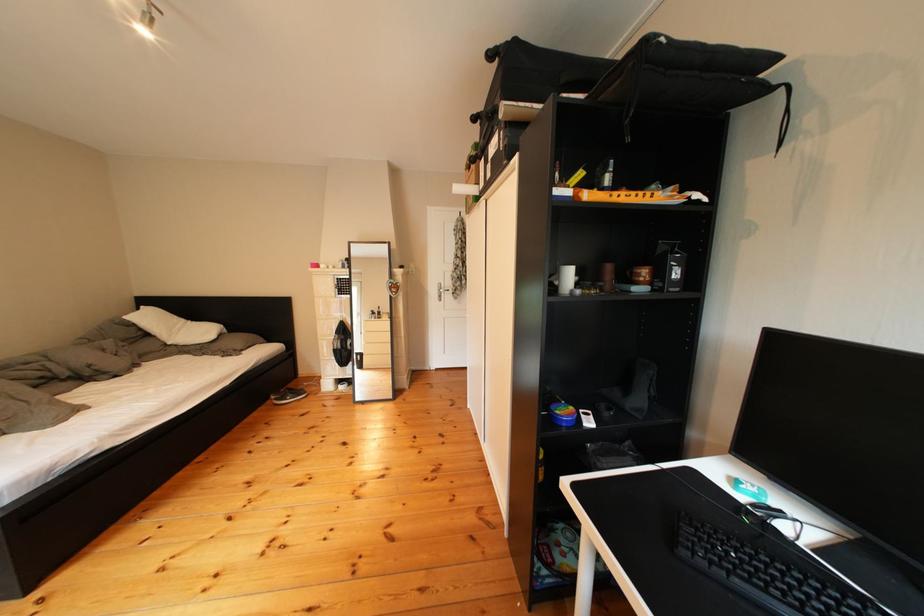
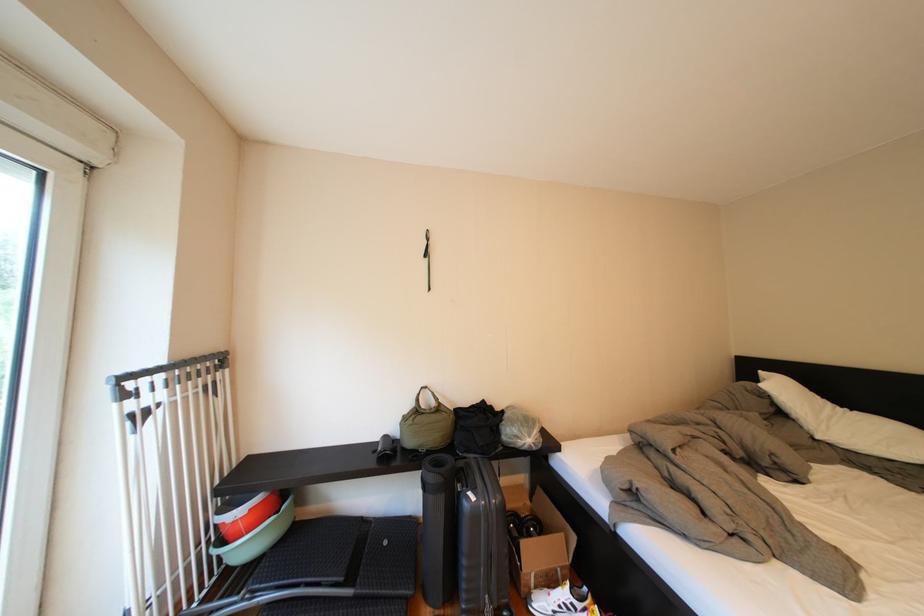
Find the pixel in the second image that matches pixel 161 339 in the first image.

(795, 419)